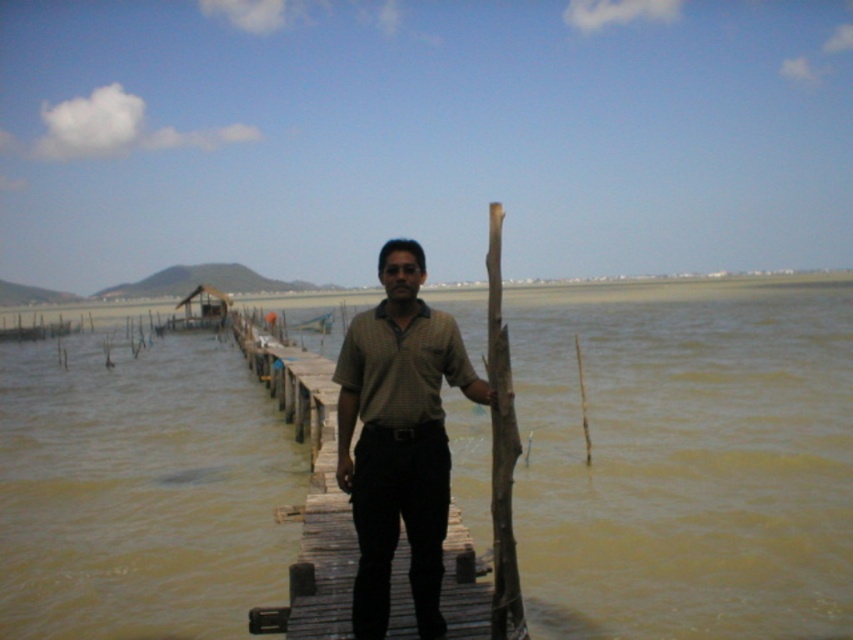
Question: Can you confirm if brown muddy water at center is bigger than brown cotton shirt at center?

Choices:
 (A) yes
 (B) no

Answer: (A)

Question: Is brown muddy water at center to the left of brown cotton shirt at center from the viewer's perspective?

Choices:
 (A) yes
 (B) no

Answer: (B)

Question: Which point appears farthest from the camera in this image?

Choices:
 (A) (657, 524)
 (B) (474, 371)

Answer: (A)

Question: Is brown muddy water at center above brown cotton shirt at center?

Choices:
 (A) no
 (B) yes

Answer: (B)